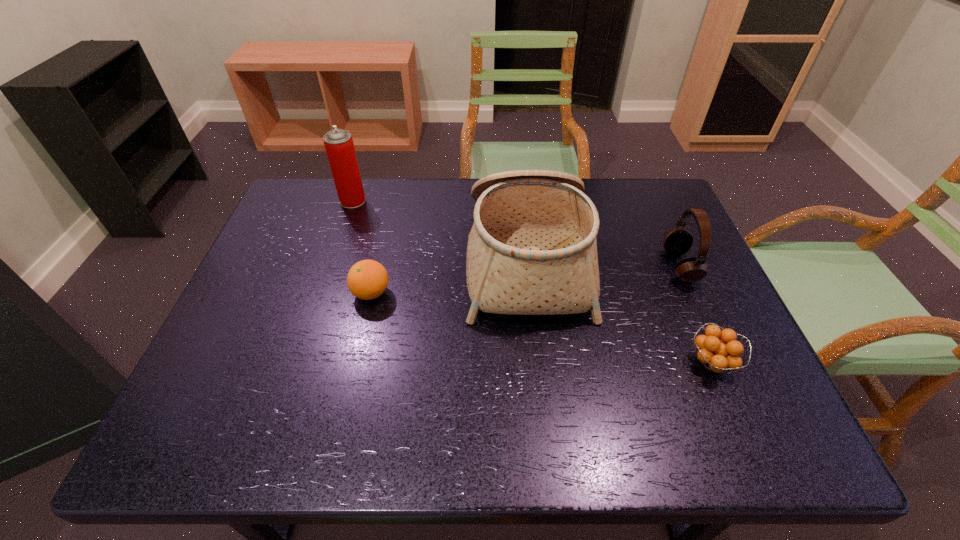
Locate an element on the screen. orange fruit that is positioned at the right edge is located at coordinates (714, 355).

Locate an element on the screen. The width and height of the screenshot is (960, 540). object positioned at the far left corner is located at coordinates (339, 146).

Identify the location of free spot at the far edge of the desktop. This screenshot has height=540, width=960. click(x=414, y=181).

Identify the location of free region at the near edge of the desktop. (461, 430).

This screenshot has width=960, height=540. What are the coordinates of `vacant space at the left edge` in the screenshot? It's located at (289, 227).

Identify the location of free point at the right edge. This screenshot has width=960, height=540. (767, 392).

Where is `blank space at the far left corner of the desktop`? The width and height of the screenshot is (960, 540). blank space at the far left corner of the desktop is located at coordinates (294, 218).

This screenshot has width=960, height=540. I want to click on free region at the far right corner, so [643, 222].

Where is `vacant area at the near right corner of the desktop`? This screenshot has width=960, height=540. vacant area at the near right corner of the desktop is located at coordinates (786, 433).

Identify the location of vacant area that lies between the aerosol can and the basket. The height and width of the screenshot is (540, 960). (440, 230).